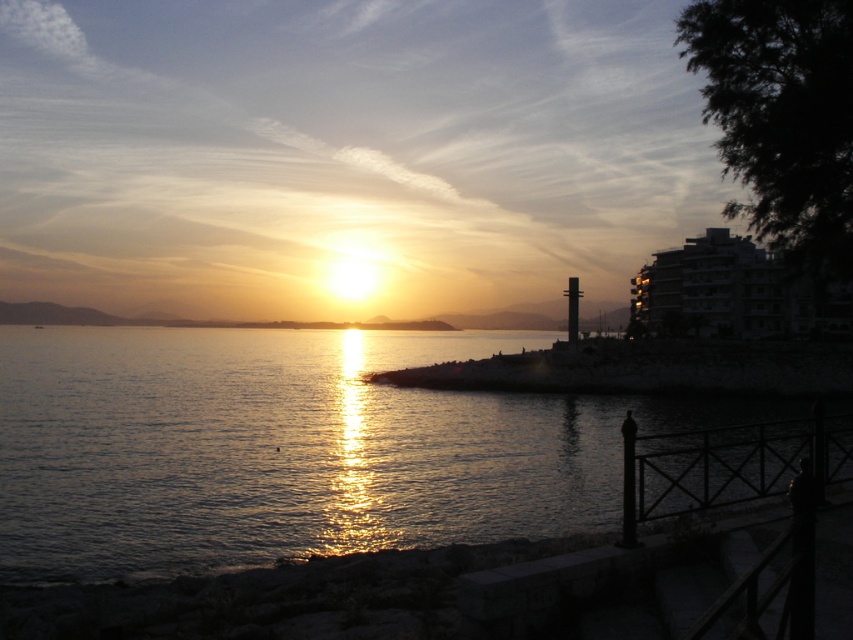
Is glistening water at center taller than dark stone shoreline at lower center?

In fact, glistening water at center may be shorter than dark stone shoreline at lower center.

Is point (416, 355) positioned after point (445, 371)?

Yes, it is.

Is point (126, 435) positioned in front of point (515, 358)?

Yes, point (126, 435) is closer to viewer.

The image size is (853, 640). In order to click on glistening water at center in this screenshot , I will do `click(292, 448)`.